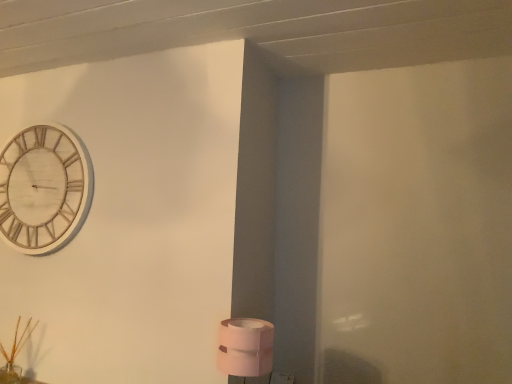
Describe the element at coordinates (44, 188) in the screenshot. The width and height of the screenshot is (512, 384). I see `white wood clock at upper left` at that location.

The width and height of the screenshot is (512, 384). Find the location of `white wood clock at upper left`. white wood clock at upper left is located at coordinates (44, 188).

The width and height of the screenshot is (512, 384). I want to click on white wood clock at upper left, so click(x=44, y=188).